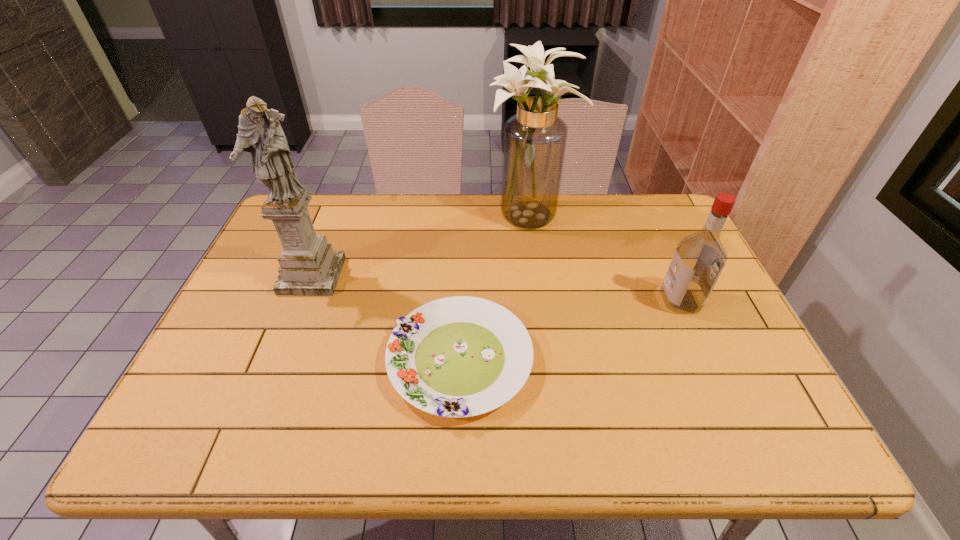
Identify the location of vacant area that lies between the flower arrangement and the shortest object. (494, 289).

You are a GUI agent. You are given a task and a screenshot of the screen. Output one action in this format:
    pyautogui.click(x=<x>, y=<y>)
    Task: Click on the vacant area that lies between the liquor and the leftmost object
    The height and width of the screenshot is (540, 960).
    Given the screenshot: What is the action you would take?
    pyautogui.click(x=496, y=288)

You are a GUI agent. You are given a task and a screenshot of the screen. Output one action in this format:
    pyautogui.click(x=<x>, y=<y>)
    Task: Click on the empty location between the farthest object and the sculpture
    
    Given the screenshot: What is the action you would take?
    pyautogui.click(x=420, y=247)

You are a GUI agent. You are given a task and a screenshot of the screen. Output one action in this format:
    pyautogui.click(x=<x>, y=<y>)
    Task: Click on the free space between the shortest object and the flower arrangement
    
    Given the screenshot: What is the action you would take?
    pyautogui.click(x=494, y=289)

Where is `vacant area between the leftmost object and the second shortest object`? The image size is (960, 540). vacant area between the leftmost object and the second shortest object is located at coordinates (496, 288).

What are the coordinates of `vacant point located between the flower arrangement and the salad plate` in the screenshot? It's located at (494, 289).

Image resolution: width=960 pixels, height=540 pixels. Find the location of `unoccupied area between the second shortest object and the leftmost object`. unoccupied area between the second shortest object and the leftmost object is located at coordinates (496, 288).

At what (x,y) coordinates should I click in order to perform the action: click on free space between the sculpture and the flower arrangement. Please return your answer as a coordinate pair (x, y). Image resolution: width=960 pixels, height=540 pixels. Looking at the image, I should click on (420, 247).

At what (x,y) coordinates should I click in order to perform the action: click on empty space between the salad plate and the leftmost object. Please return your answer as a coordinate pair (x, y). This screenshot has height=540, width=960. Looking at the image, I should click on (386, 318).

Locate an element on the screen. The image size is (960, 540). free space between the flower arrangement and the sculpture is located at coordinates (420, 247).